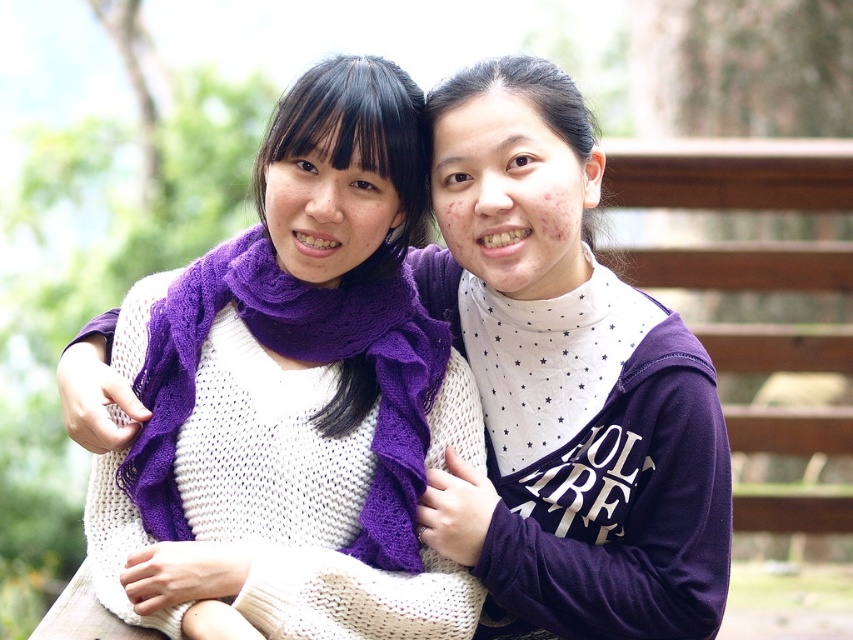
Question: Is purple knitted scarf at center to the left of purple knitted scarf at left from the viewer's perspective?

Choices:
 (A) no
 (B) yes

Answer: (A)

Question: Is purple knitted scarf at center to the left of purple knit sweater at center from the viewer's perspective?

Choices:
 (A) yes
 (B) no

Answer: (A)

Question: Is the position of purple knit sweater at center more distant than that of purple knitted scarf at left?

Choices:
 (A) no
 (B) yes

Answer: (B)

Question: Estimate the real-world distances between objects in this image. Which object is farther from the purple knit sweater at center?

Choices:
 (A) purple knitted scarf at center
 (B) purple knitted scarf at left

Answer: (B)

Question: Estimate the real-world distances between objects in this image. Which object is closer to the purple knit sweater at center?

Choices:
 (A) purple knitted scarf at center
 (B) purple knitted scarf at left

Answer: (A)

Question: Considering the real-world distances, which object is farthest from the purple knitted scarf at left?

Choices:
 (A) purple knit sweater at center
 (B) purple knitted scarf at center

Answer: (A)